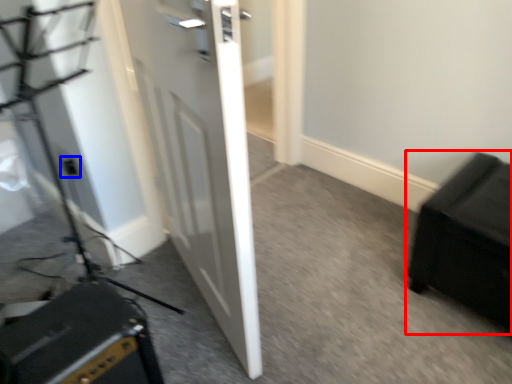
Question: Which object is further to the camera taking this photo, furniture (highlighted by a red box) or electric outlet (highlighted by a blue box)?

Choices:
 (A) furniture
 (B) electric outlet

Answer: (B)